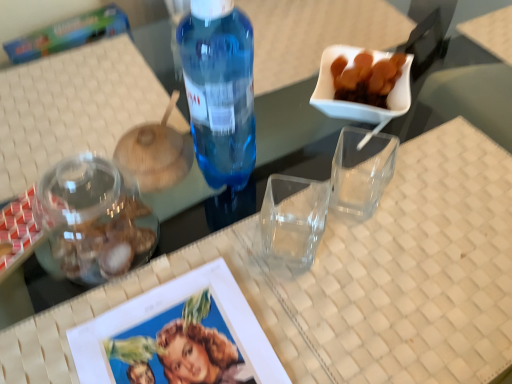
Question: Does translucent plastic bottle at center lie behind clear glass jar at lower left?

Choices:
 (A) yes
 (B) no

Answer: (B)

Question: Considering the relative positions of translucent plastic bottle at center and clear glass jar at lower left in the image provided, is translucent plastic bottle at center to the right of clear glass jar at lower left from the viewer's perspective?

Choices:
 (A) no
 (B) yes

Answer: (B)

Question: Is translucent plastic bottle at center thinner than clear glass jar at lower left?

Choices:
 (A) yes
 (B) no

Answer: (A)

Question: Is translucent plastic bottle at center shorter than clear glass jar at lower left?

Choices:
 (A) no
 (B) yes

Answer: (A)

Question: Is translucent plastic bottle at center outside clear glass jar at lower left?

Choices:
 (A) no
 (B) yes

Answer: (B)

Question: Is translucent plastic bottle at center taller than clear glass jar at lower left?

Choices:
 (A) yes
 (B) no

Answer: (A)

Question: Does clear glass jar at lower left appear on the left side of translucent plastic bottle at center?

Choices:
 (A) no
 (B) yes

Answer: (B)

Question: Considering the relative sizes of clear glass jar at lower left and translucent plastic bottle at center in the image provided, is clear glass jar at lower left smaller than translucent plastic bottle at center?

Choices:
 (A) yes
 (B) no

Answer: (A)

Question: Is clear glass jar at lower left not close to translucent plastic bottle at center?

Choices:
 (A) yes
 (B) no

Answer: (B)

Question: Is clear glass jar at lower left at the right side of translucent plastic bottle at center?

Choices:
 (A) no
 (B) yes

Answer: (A)

Question: Does clear glass jar at lower left contain translucent plastic bottle at center?

Choices:
 (A) yes
 (B) no

Answer: (B)

Question: Is clear glass jar at lower left oriented towards translucent plastic bottle at center?

Choices:
 (A) yes
 (B) no

Answer: (B)

Question: Would you say translucent plastic bottle at center is inside or outside clear glass jar at lower left?

Choices:
 (A) outside
 (B) inside

Answer: (A)